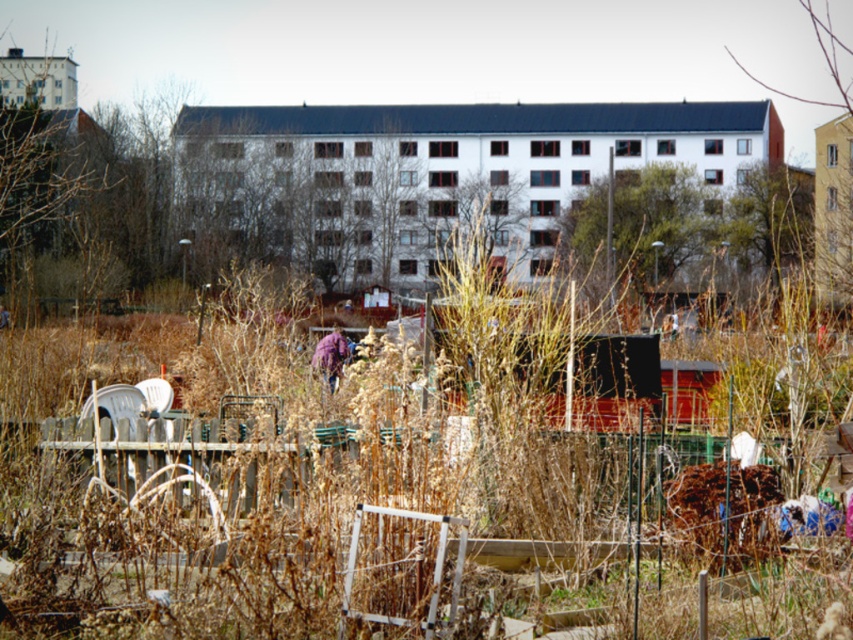
Question: Among these objects, which one is farthest from the camera?

Choices:
 (A) purple fabric at center
 (B) white plastic chair at center

Answer: (A)

Question: Does white plastic chair at center appear over purple fabric at center?

Choices:
 (A) no
 (B) yes

Answer: (A)

Question: Considering the relative positions of white plastic chair at center and purple fabric at center in the image provided, where is white plastic chair at center located with respect to purple fabric at center?

Choices:
 (A) above
 (B) below

Answer: (B)

Question: Is the position of white plastic chair at center more distant than that of purple fabric at center?

Choices:
 (A) yes
 (B) no

Answer: (B)